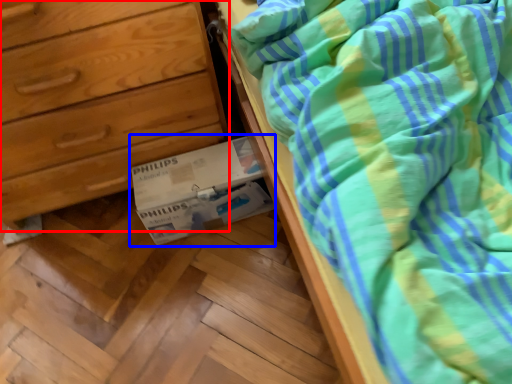
Question: Among these objects, which one is farthest to the camera, chest of drawers (highlighted by a red box) or cardboard box (highlighted by a blue box)?

Choices:
 (A) chest of drawers
 (B) cardboard box

Answer: (B)